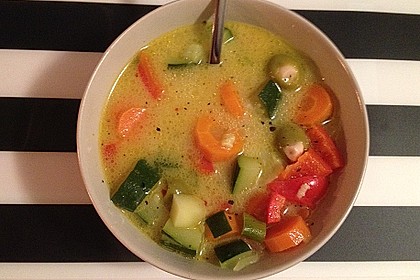
At what (x,y) coordinates should I click in order to perform the action: click on spoon. Please return your answer as a coordinate pair (x, y). The width and height of the screenshot is (420, 280). Looking at the image, I should click on (219, 43).